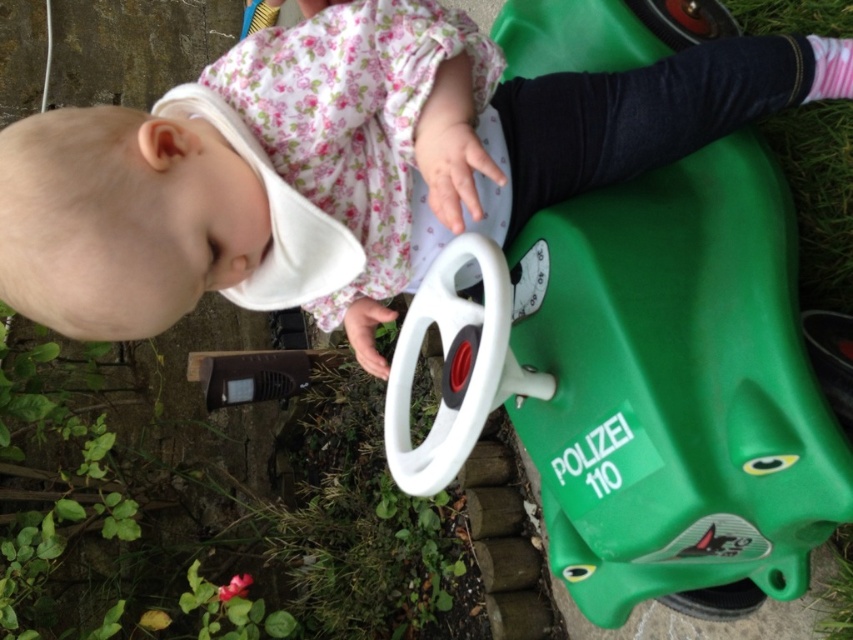
You are a photographer trying to capture the green plastic toy car at lower right in the center of your photo. Given its current position at point 0.603, 0.792, what direction should you move your camera to center it?

To center the green plastic toy car at lower right, move the camera upward and to the left since its current position is at the lower right of the image frame.